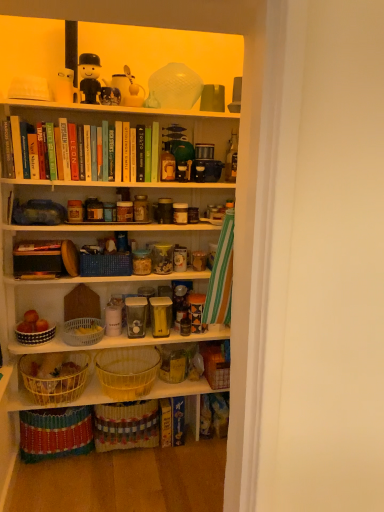
In order to face blue woven picnic basket at center, should I rotate leftwards or rightwards?

You should rotate left by 11.214 degrees.

The width and height of the screenshot is (384, 512). Find the location of `white matte bookshelf at upper center`. white matte bookshelf at upper center is located at coordinates (116, 237).

Describe the element at coordinates (231, 159) in the screenshot. I see `matte glass bottle at center, which is the 2th bottle from left to right` at that location.

What do you see at coordinates (140, 153) in the screenshot?
I see `green matte book at upper center, which appears as the third book when viewed from the left` at bounding box center [140, 153].

Image resolution: width=384 pixels, height=512 pixels. In order to click on hardcover book at center, arranged as the 6th book when viewed from the top in this screenshot , I will do `click(166, 423)`.

Consider the image. Is smooth plastic toy at upper center, the second toy in the left-to-right sequence, with green matte book at upper center, the seventh book ordered from the bottom?

No, smooth plastic toy at upper center, the second toy in the left-to-right sequence, is not in contact with green matte book at upper center, the seventh book ordered from the bottom.

From the image's perspective, is smooth plastic toy at upper center, marked as the second toy in a right-to-left arrangement, under green matte book at upper center, placed as the first book when sorted from top to bottom?

No, from the image's perspective, smooth plastic toy at upper center, marked as the second toy in a right-to-left arrangement, is not beneath green matte book at upper center, placed as the first book when sorted from top to bottom.

Which is more to the right, smooth plastic toy at upper center, marked as the second toy in a right-to-left arrangement, or green matte book at upper center, which is the 3th book in right-to-left order?

green matte book at upper center, which is the 3th book in right-to-left order.

Which object is more forward, black and white ceramic bowl at lower left or hardcover book at center, the sixth book in the left-to-right sequence?

black and white ceramic bowl at lower left is in front.

From a real-world perspective, who is located higher, black and white ceramic bowl at lower left or hardcover book at center, the sixth book in the left-to-right sequence?

black and white ceramic bowl at lower left is physically above.

From the image's perspective, does black and white ceramic bowl at lower left appear higher than hardcover book at center, the second book in the bottom-to-top sequence?

Yes, from the image's perspective, black and white ceramic bowl at lower left is over hardcover book at center, the second book in the bottom-to-top sequence.

From the image's perspective, is hardcover book at center, the 4th book in the bottom-to-top sequence, beneath yellow wicker basket at lower left, arranged as the first box when viewed from the left?

No.

Is yellow wicker basket at lower left, arranged as the first box when viewed from the left, completely or partially inside hardcover book at center, the 4th book in the bottom-to-top sequence?

No, yellow wicker basket at lower left, arranged as the first box when viewed from the left, is not inside hardcover book at center, the 4th book in the bottom-to-top sequence.

Who is shorter, hardcover book at center, acting as the fourth book starting from the left, or yellow wicker basket at lower left, the third box viewed from the right?

yellow wicker basket at lower left, the third box viewed from the right.

Which object is thinner, hardcover book at center, the 4th book in the bottom-to-top sequence, or yellow wicker basket at lower left, the third box viewed from the right?

Thinner between the two is hardcover book at center, the 4th book in the bottom-to-top sequence.

The image size is (384, 512). What are the coordinates of `bookcase above the white plastic basket at center, placed as the second box when sorted from left to right (from the image's perspective)` in the screenshot? It's located at pyautogui.click(x=116, y=237).

Which is correct: white matte bookshelf at upper center is inside white plastic basket at center, placed as the second box when sorted from left to right, or outside of it?

white matte bookshelf at upper center exists outside the volume of white plastic basket at center, placed as the second box when sorted from left to right.

From a real-world perspective, is white matte bookshelf at upper center positioned under white plastic basket at center, the 2th box viewed from the right, based on gravity?

No, from a real-world perspective, white matte bookshelf at upper center is not below white plastic basket at center, the 2th box viewed from the right.

Based on their sizes in the image, would you say white matte bookshelf at upper center is bigger or smaller than white plastic basket at center, placed as the second box when sorted from left to right?

Considering their sizes, white matte bookshelf at upper center takes up more space than white plastic basket at center, placed as the second box when sorted from left to right.

Is green matte book at upper center, which appears as the fifth book when viewed from the left, to the right of matte white coffee cup at upper center from the viewer's perspective?

Incorrect, green matte book at upper center, which appears as the fifth book when viewed from the left, is not on the right side of matte white coffee cup at upper center.

Which object is more forward, green matte book at upper center, placed as the first book when sorted from top to bottom, or matte white coffee cup at upper center?

Positioned in front is matte white coffee cup at upper center.

Are green matte book at upper center, the seventh book ordered from the bottom, and matte white coffee cup at upper center beside each other?

green matte book at upper center, the seventh book ordered from the bottom, and matte white coffee cup at upper center are not in contact.

How much distance is there between green matte book at upper center, which is the 3th book in right-to-left order, and matte white coffee cup at upper center?

green matte book at upper center, which is the 3th book in right-to-left order, is 32.35 centimeters from matte white coffee cup at upper center.

How different are the orientations of smooth plastic toy at upper center, marked as the second toy in a right-to-left arrangement, and hardcover book at center, the second book in the right-to-left sequence, in degrees?

They differ by 1.64 degrees in their facing directions.

Which is more to the left, smooth plastic toy at upper center, marked as the second toy in a right-to-left arrangement, or hardcover book at center, the sixth book in the left-to-right sequence?

smooth plastic toy at upper center, marked as the second toy in a right-to-left arrangement, is more to the left.

From a real-world perspective, is smooth plastic toy at upper center, marked as the second toy in a right-to-left arrangement, located higher than hardcover book at center, the second book in the bottom-to-top sequence?

Yes, from a real-world perspective, smooth plastic toy at upper center, marked as the second toy in a right-to-left arrangement, is over hardcover book at center, the second book in the bottom-to-top sequence

Is hardcover book at center, marked as the fifth book in a bottom-to-top arrangement, turned away from green matte book at upper center, the seventh book ordered from the bottom?

No, hardcover book at center, marked as the fifth book in a bottom-to-top arrangement,'s orientation is not away from green matte book at upper center, the seventh book ordered from the bottom.

Is hardcover book at center, marked as the fifth book in a bottom-to-top arrangement, far from green matte book at upper center, which appears as the fifth book when viewed from the left?

No.

Which is in front, point (127, 151) or point (157, 157)?

Point (127, 151)

Considering the sizes of objects hardcover book at center, marked as the fifth book in a bottom-to-top arrangement, and green matte book at upper center, placed as the first book when sorted from top to bottom, in the image provided, who is bigger, hardcover book at center, marked as the fifth book in a bottom-to-top arrangement, or green matte book at upper center, placed as the first book when sorted from top to bottom,?

hardcover book at center, marked as the fifth book in a bottom-to-top arrangement, is bigger.

At what (x,y) coordinates should I click in order to perform the action: click on book that is the 1st one when counting downward from the smooth plastic toy at upper center, the second toy in the left-to-right sequence (from the image's perspective). Please return your answer as a coordinate pair (x, y). The image size is (384, 512). Looking at the image, I should click on (155, 152).

Identify the location of book that is the 2nd one below the black and white ceramic bowl at lower left (from a real-world perspective). (166, 423).

Which object lies further to the anchor point white plastic basket at center, the 2th box viewed from the right, black and white ceramic bowl at lower left or matte white coffee cup at upper center?

Among the two, matte white coffee cup at upper center is located further to white plastic basket at center, the 2th box viewed from the right.

Which object lies nearer to the anchor point hardcover book at upper left, the 5th book viewed from the top, black plastic toy at upper center, positioned as the first toy in left-to-right order, or green matte book at upper center, which is the 3th book in right-to-left order?

black plastic toy at upper center, positioned as the first toy in left-to-right order, is closer to hardcover book at upper left, the 5th book viewed from the top.

Which object lies nearer to the anchor point matte glass bottle at center, which is the 2th bottle from left to right, yellow wicker basket at lower left, arranged as the first box when viewed from the left, or black plastic toy at upper center, positioned as the first toy in left-to-right order?

The object closer to matte glass bottle at center, which is the 2th bottle from left to right, is black plastic toy at upper center, positioned as the first toy in left-to-right order.

When comparing their distances from matte white coffee cup at upper center, does green matte book at upper center, the seventh book ordered from the bottom, or black and white ceramic bowl at lower left seem closer?

green matte book at upper center, the seventh book ordered from the bottom, is closer to matte white coffee cup at upper center.

When comparing their distances from yellow wicker basket at lower left, the third box viewed from the right, does hardcover book at center, acting as the 6th book starting from the right, or smooth plastic toy at upper center, marked as the second toy in a right-to-left arrangement, seem closer?

The object closer to yellow wicker basket at lower left, the third box viewed from the right, is hardcover book at center, acting as the 6th book starting from the right.

Looking at the image, which one is located further to blue woven picnic basket at center, green matte book at upper center, which appears as the fifth book when viewed from the left, or white matte bookshelf at upper center?

green matte book at upper center, which appears as the fifth book when viewed from the left, lies further to blue woven picnic basket at center than the other object.

When comparing their distances from white matte bookshelf at upper center, does yellow wicker basket at center, the third box viewed from the left, or hardcover book at center, which ranks as the fourth book in right-to-left order, seem further?

hardcover book at center, which ranks as the fourth book in right-to-left order.

Which object lies further to the anchor point bright yellow wicker basket at lower center, black and white ceramic bowl at lower left or matte yellow figurine at upper center, acting as the third toy starting from the left?

The object further to bright yellow wicker basket at lower center is matte yellow figurine at upper center, acting as the third toy starting from the left.

You are a GUI agent. You are given a task and a screenshot of the screen. Output one action in this format:
    pyautogui.click(x=<x>, y=<y>)
    Task: Click on the bottle between matte glass bottle at center, which is the 2th bottle from left to right, and hardcover book at center, which is the seventh book from top to bottom, in the vertical direction
    Image resolution: width=384 pixels, height=512 pixels.
    Given the screenshot: What is the action you would take?
    pyautogui.click(x=167, y=164)

Image resolution: width=384 pixels, height=512 pixels. What are the coordinates of `basket between hardcover book at center, marked as the fifth book in a bottom-to-top arrangement, and hardcover book at center, the second book in the bottom-to-top sequence, in the up-down direction` in the screenshot? It's located at (126, 425).

Locate an element on the screen. The width and height of the screenshot is (384, 512). bowl between hardcover book at upper left, the 5th book viewed from the top, and bright yellow wicker basket at lower center in the up-down direction is located at coordinates (35, 336).

Where is `picnic basket located between hardcover book at upper left, acting as the 3th book starting from the bottom, and green matte book at upper center, which is the 3th book in right-to-left order, in the left-right direction`? picnic basket located between hardcover book at upper left, acting as the 3th book starting from the bottom, and green matte book at upper center, which is the 3th book in right-to-left order, in the left-right direction is located at coordinates 105,264.